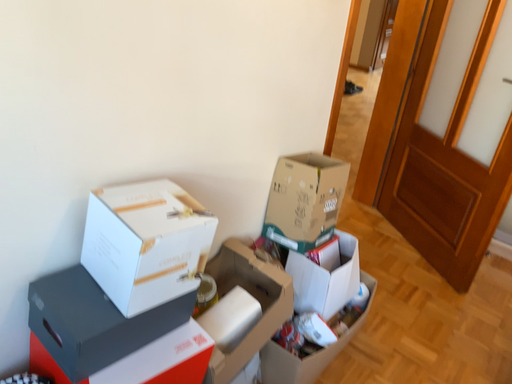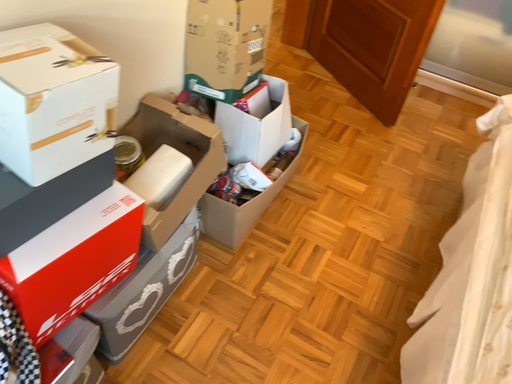
Question: How did the camera likely rotate when shooting the video?

Choices:
 (A) rotated right
 (B) rotated left

Answer: (A)